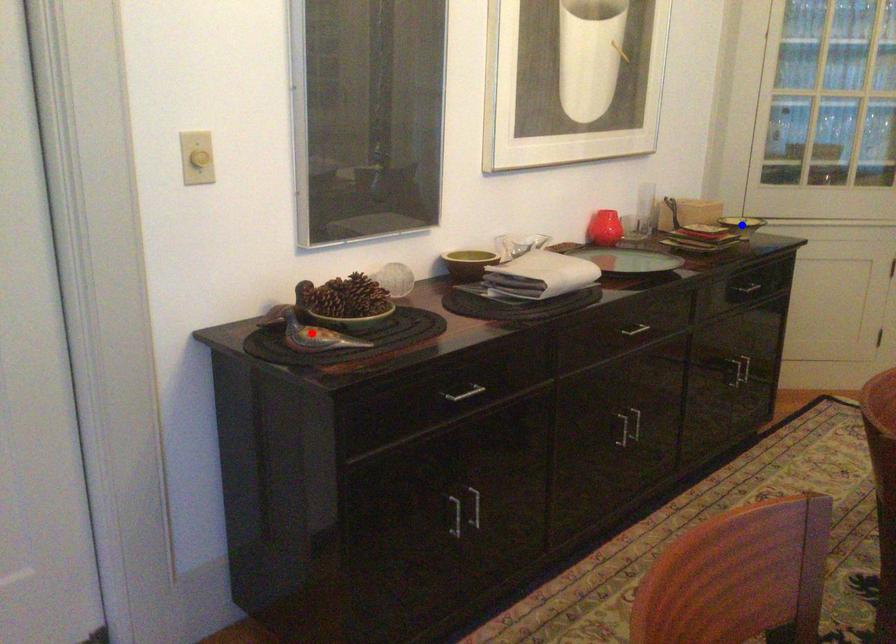
Question: In the image, two points are highlighted. Which point is nearer to the camera? Reply with the corresponding letter.

Choices:
 (A) blue point
 (B) red point

Answer: (B)